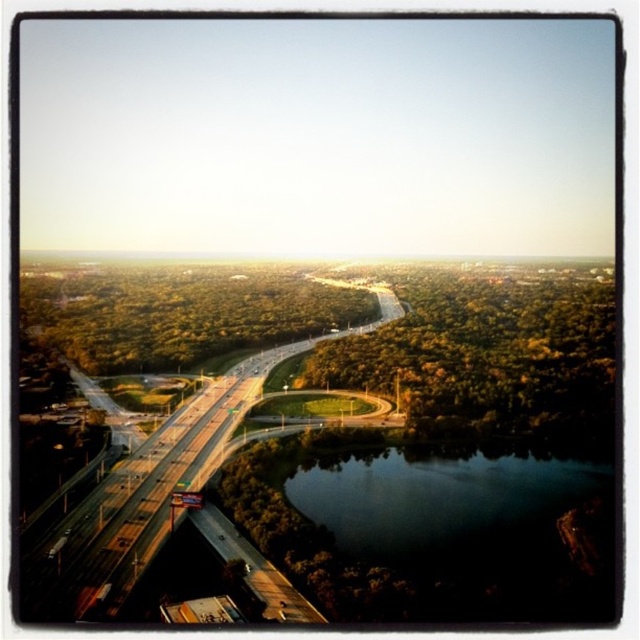
Question: Which point appears closest to the camera in this image?

Choices:
 (A) (112, 614)
 (B) (531, 595)

Answer: (A)

Question: Which of the following is the closest to the observer?

Choices:
 (A) (61, 586)
 (B) (349, 538)

Answer: (A)

Question: Observing the image, what is the correct spatial positioning of dark reflective water at lower center in reference to green asphalt highway at center?

Choices:
 (A) below
 (B) above

Answer: (A)

Question: Is dark reflective water at lower center above green asphalt highway at center?

Choices:
 (A) yes
 (B) no

Answer: (B)

Question: Observing the image, what is the correct spatial positioning of dark reflective water at lower center in reference to green asphalt highway at center?

Choices:
 (A) left
 (B) right

Answer: (B)